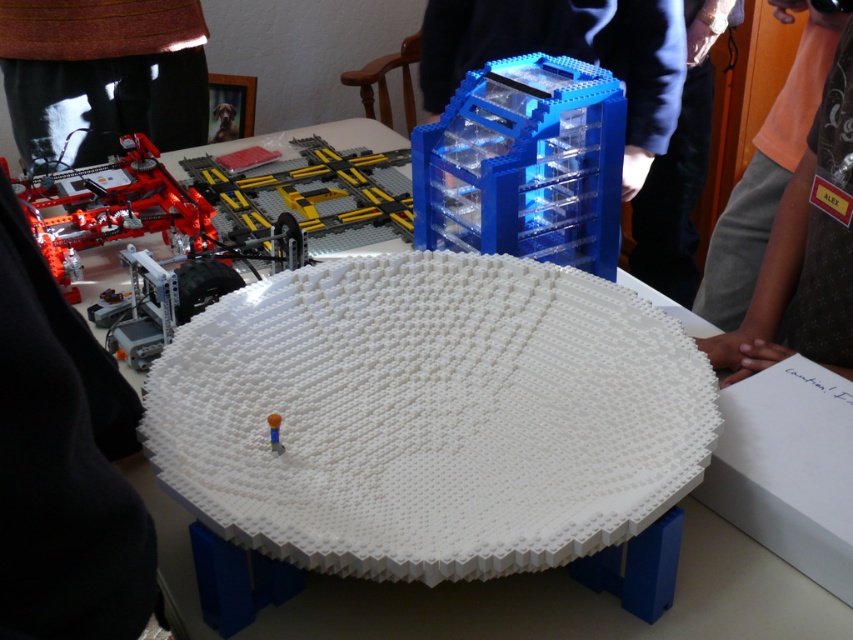
Consider the image. You are setting up a dining table and need to place a centerpiece. Given the white plastic plate at center and the matte black monitor at upper left, which object is shorter and better suited for the centerpiece? Please explain your reasoning.

The white plastic plate at center is not as tall as the matte black monitor at upper left, so it is shorter and better suited for the centerpiece.

You are holding a measuring tape and want to measure the distance between you and the point marked at coordinates (576,540) on the table. If the table is 1 meter away from you, can you reach the point with your measuring tape?

The point marked at coordinates (576,540) is 75.26 centimeters away from the viewer. Since the table is 1 meter away, the total distance would be 1 meter plus 75.26 centimeters, which exceeds the typical measuring tape length. However, if the point is on the table surface, the distance from you to the point is 75.26 cm, which is within reach of most measuring tapes.

You are a LEGO builder trying to stack a new LEGO brick. You have the transparent blue cube at center and the orange fabric shirt at upper right in your view. Which object is shorter so you can place your brick on top?

The transparent blue cube at center is not as tall as the orange fabric shirt at upper right, so you can place your brick on top of the transparent blue cube at center since it is shorter.